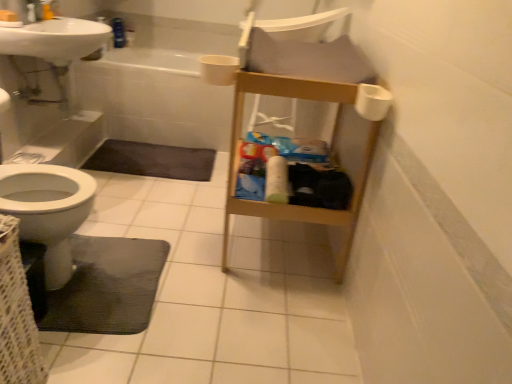
This screenshot has width=512, height=384. I want to click on vacant area that is in front of dark gray matte bath mat at lower left, which is the second bath mat in front-to-back order, so click(x=152, y=197).